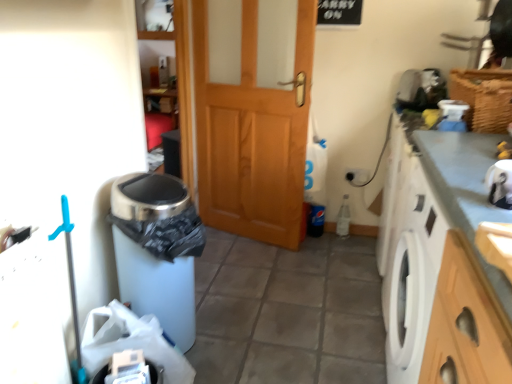
Question: In terms of size, does wooden door at center appear bigger or smaller than smooth gray countertop at right?

Choices:
 (A) big
 (B) small

Answer: (B)

Question: Based on their positions, is wooden door at center located to the left or right of smooth gray countertop at right?

Choices:
 (A) right
 (B) left

Answer: (B)

Question: Based on their relative distances, which object is nearer to the white matte trash can at lower left?

Choices:
 (A) woven brown basket at upper right
 (B) wooden door at center
 (C) smooth gray countertop at right
 (D) white plastic bag at lower left

Answer: (D)

Question: Which is farther from the wooden door at center?

Choices:
 (A) white matte trash can at lower left
 (B) white plastic bag at lower left
 (C) woven brown basket at upper right
 (D) smooth gray countertop at right

Answer: (B)